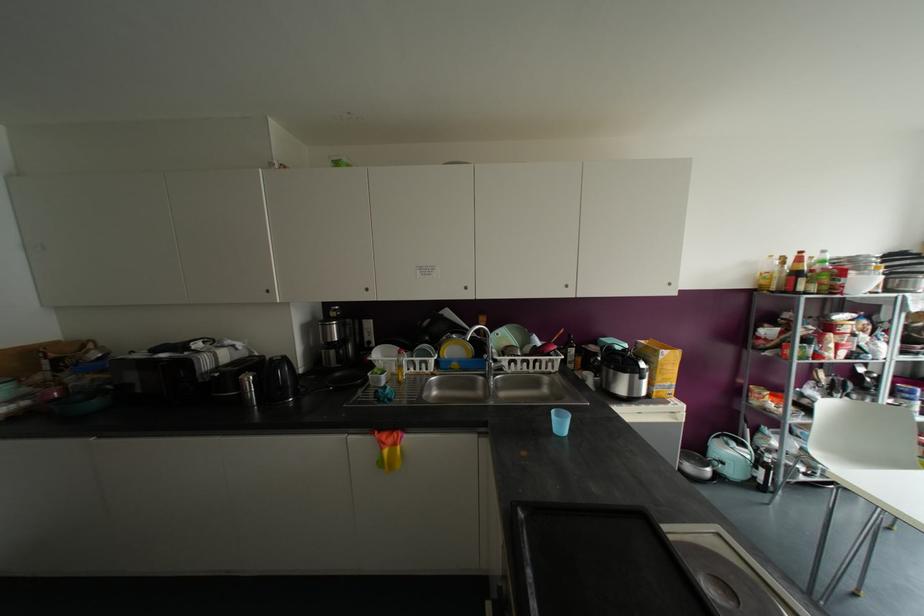
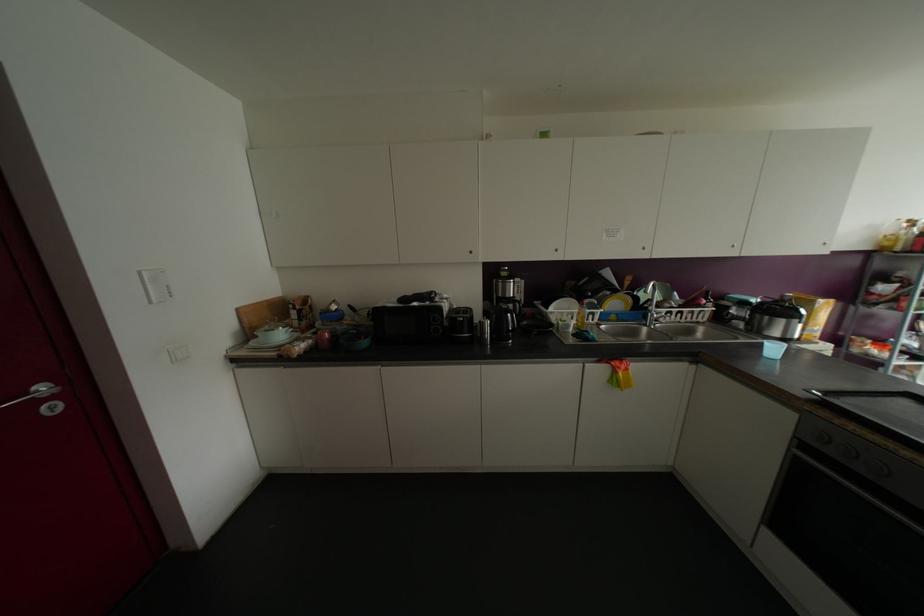
Locate, in the second image, the point that corresponds to (465,286) in the first image.

(642, 248)